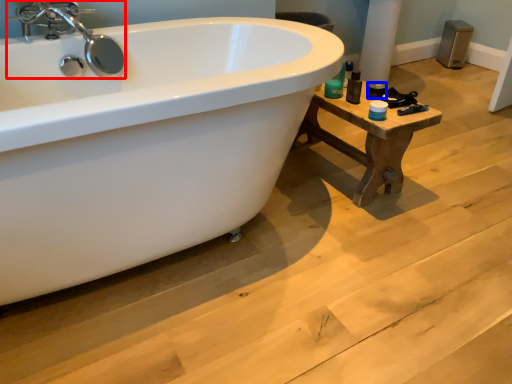
Question: Which object is further to the camera taking this photo, tap (highlighted by a red box) or toiletry (highlighted by a blue box)?

Choices:
 (A) tap
 (B) toiletry

Answer: (B)